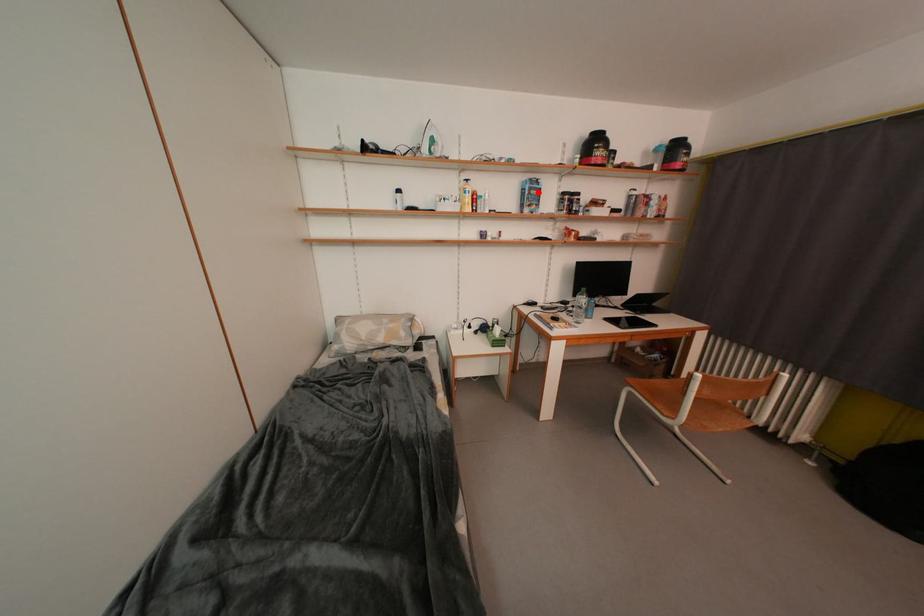
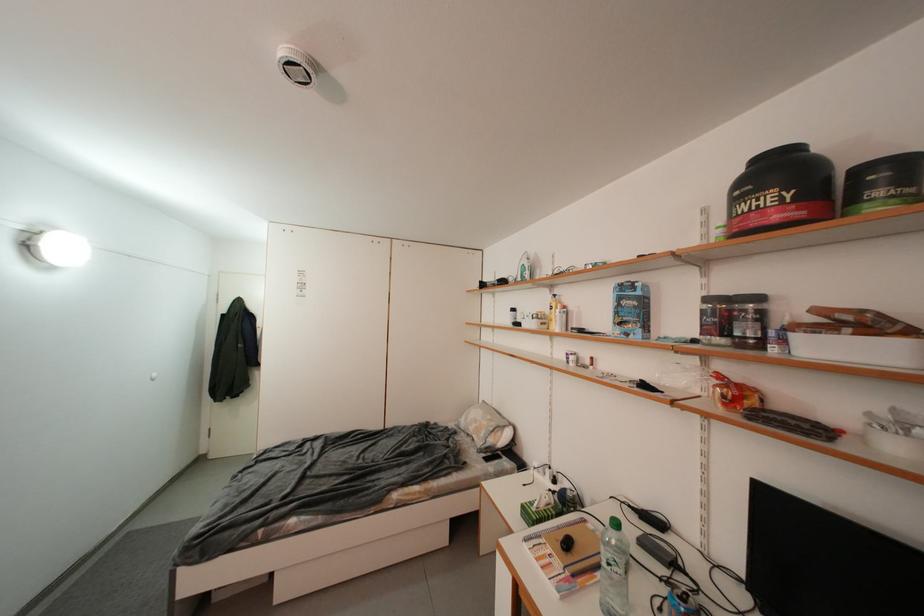
Question: A red point is marked in image1. In image2, is the corresponding 3D point closer to the camera or farther? Reply with the corresponding letter.

Choices:
 (A) The corresponding 3D point is closer.
 (B) The corresponding 3D point is farther.

Answer: (B)